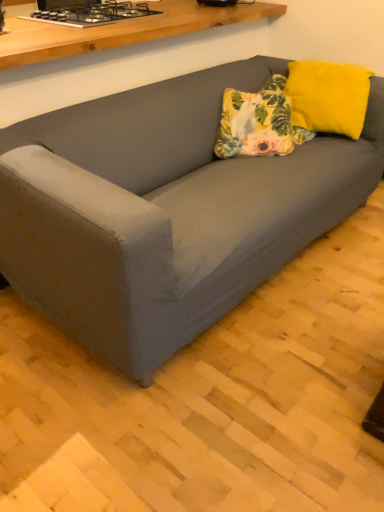
Question: Can you confirm if suede gray couch at center is taller than black glass stove at upper left?

Choices:
 (A) no
 (B) yes

Answer: (B)

Question: Can you confirm if suede gray couch at center is shorter than black glass stove at upper left?

Choices:
 (A) no
 (B) yes

Answer: (A)

Question: Could you tell me if suede gray couch at center is facing black glass stove at upper left?

Choices:
 (A) no
 (B) yes

Answer: (A)

Question: From the image's perspective, would you say suede gray couch at center is positioned over black glass stove at upper left?

Choices:
 (A) yes
 (B) no

Answer: (B)

Question: From a real-world perspective, is suede gray couch at center physically above black glass stove at upper left?

Choices:
 (A) no
 (B) yes

Answer: (A)

Question: From a real-world perspective, is yellow fuzzy pillow at upper right positioned above or below suede gray couch at center?

Choices:
 (A) above
 (B) below

Answer: (A)

Question: Visually, is yellow fuzzy pillow at upper right positioned to the left or to the right of suede gray couch at center?

Choices:
 (A) left
 (B) right

Answer: (B)

Question: Is point (302, 115) positioned closer to the camera than point (218, 167)?

Choices:
 (A) farther
 (B) closer

Answer: (A)

Question: From the image's perspective, relative to suede gray couch at center, is yellow fuzzy pillow at upper right above or below?

Choices:
 (A) above
 (B) below

Answer: (B)

Question: Based on their sizes in the image, would you say black glass stove at upper left is bigger or smaller than yellow fuzzy pillow at upper right?

Choices:
 (A) big
 (B) small

Answer: (B)

Question: Does point (79, 16) appear closer or farther from the camera than point (350, 97)?

Choices:
 (A) farther
 (B) closer

Answer: (B)

Question: From a real-world perspective, is black glass stove at upper left above or below yellow fuzzy pillow at upper right?

Choices:
 (A) below
 (B) above

Answer: (B)

Question: Which is correct: black glass stove at upper left is inside yellow fuzzy pillow at upper right, or outside of it?

Choices:
 (A) outside
 (B) inside

Answer: (A)

Question: From the image's perspective, is suede gray couch at center located above or below yellow fuzzy pillow at upper right?

Choices:
 (A) above
 (B) below

Answer: (A)

Question: Is suede gray couch at center situated inside yellow fuzzy pillow at upper right or outside?

Choices:
 (A) inside
 (B) outside

Answer: (B)